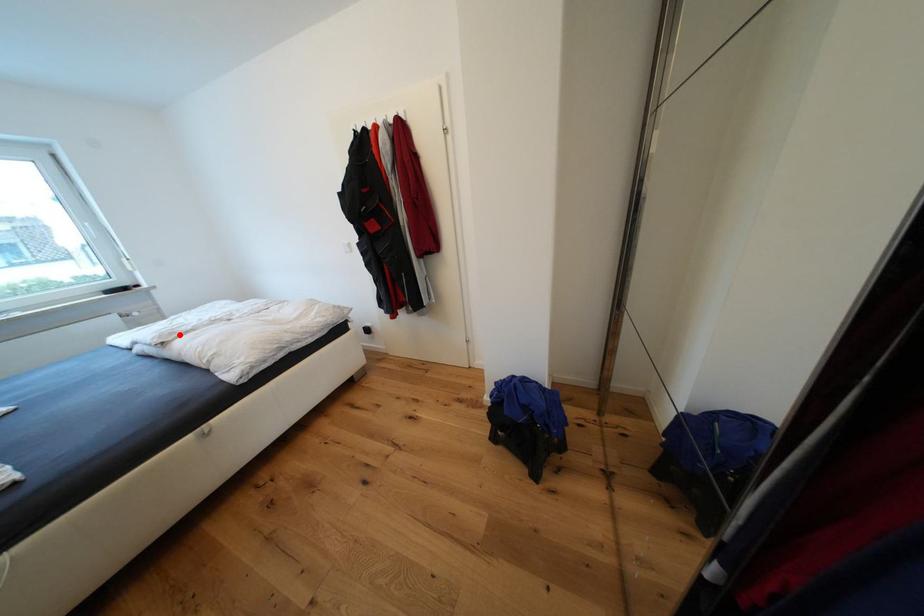
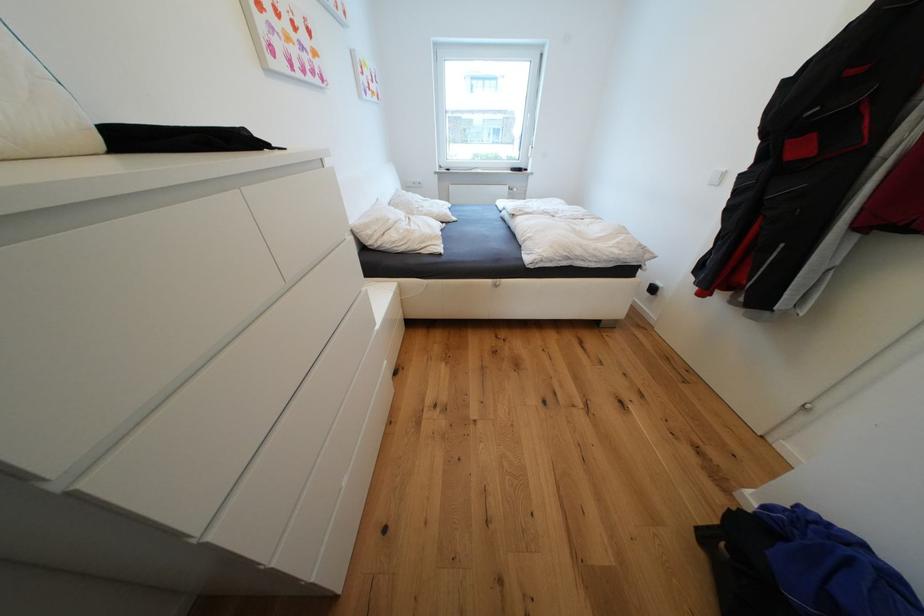
Where in the second image is the point corresponding to the highlighted location from the first image?

(528, 212)